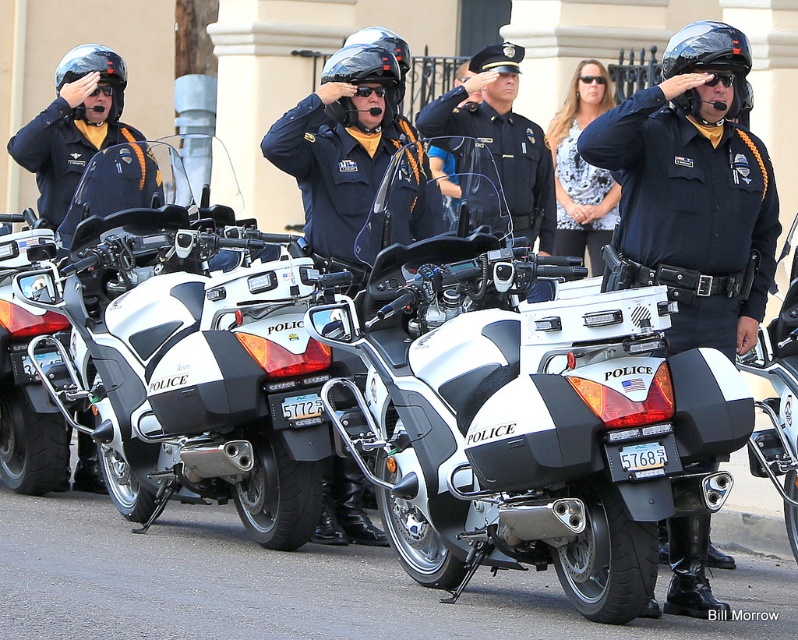
Between white matte police motorcycle at center and white textured shirt at center, which one appears on the right side from the viewer's perspective?

white textured shirt at center is more to the right.

This screenshot has width=798, height=640. What do you see at coordinates (192, 355) in the screenshot?
I see `white matte police motorcycle at center` at bounding box center [192, 355].

This screenshot has height=640, width=798. In order to click on white matte police motorcycle at center in this screenshot , I will do `click(192, 355)`.

Can you confirm if white textured shirt at center is bigger than matte black helmet at left?

Actually, white textured shirt at center might be smaller than matte black helmet at left.

Is white textured shirt at center shorter than matte black helmet at left?

Correct, white textured shirt at center is not as tall as matte black helmet at left.

Describe the element at coordinates (581, 170) in the screenshot. I see `white textured shirt at center` at that location.

At what (x,y) coordinates should I click in order to perform the action: click on white textured shirt at center. Please return your answer as a coordinate pair (x, y). Image resolution: width=798 pixels, height=640 pixels. Looking at the image, I should click on (581, 170).

Can you confirm if black matte helmet at center is positioned below glossy black helmet at center?

→ Correct, black matte helmet at center is located below glossy black helmet at center.

Does black matte helmet at center appear over glossy black helmet at center?

No.

Between point (682, 35) and point (389, 72), which one is positioned in front?

Point (682, 35) is more forward.

You are a GUI agent. You are given a task and a screenshot of the screen. Output one action in this format:
    pyautogui.click(x=<x>, y=<y>)
    Task: Click on the black matte helmet at center
    This screenshot has height=640, width=798.
    Given the screenshot: What is the action you would take?
    pyautogui.click(x=712, y=60)